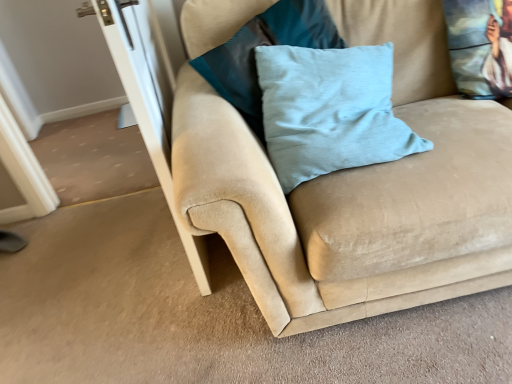
Where is `vacant space that is to the left of transparent glass screen door at left`? The image size is (512, 384). vacant space that is to the left of transparent glass screen door at left is located at coordinates (112, 270).